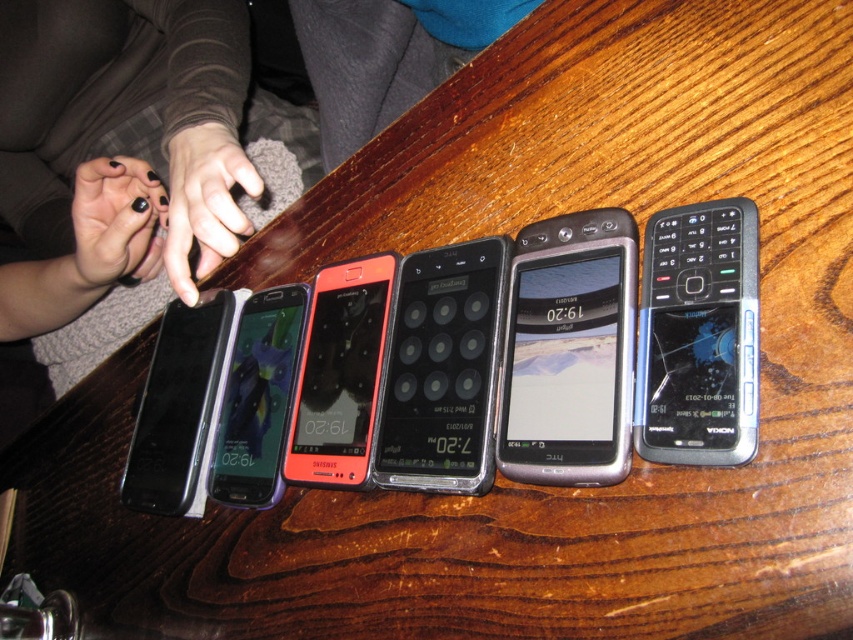
You are standing at the edge of the table where the first phone is placed. You want to reach the matte black phone at center. Which direction should you move your hand to grab it?

You should move your hand to the right because the matte black phone at center is located to the right of the first phone.

From the picture: You are organizing items on a wooden table and notice the matte black phone at center and the black nail polish at left. Which item is positioned lower on the table?

The matte black phone at center is positioned lower than the black nail polish at left, so it is lower on the table.

You are trying to fit both the metallic silver smartphone at center and the black matte keypad phone at center into a rectangular box that can only accommodate items up to the width of the wider of the two. Which phone determines the maximum width required for the box?

The black matte keypad phone at center is wider than the metallic silver smartphone at center, so it determines the maximum width required for the box.